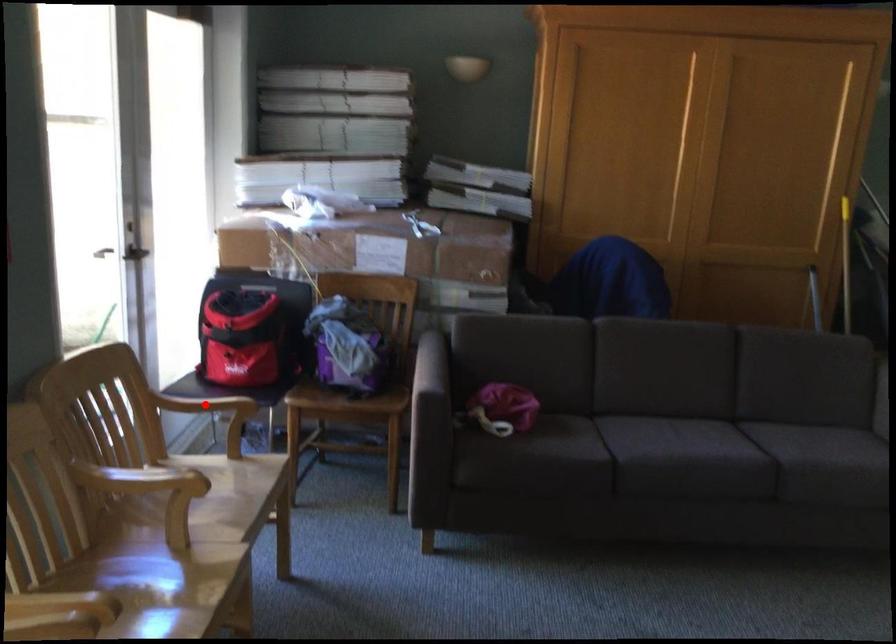
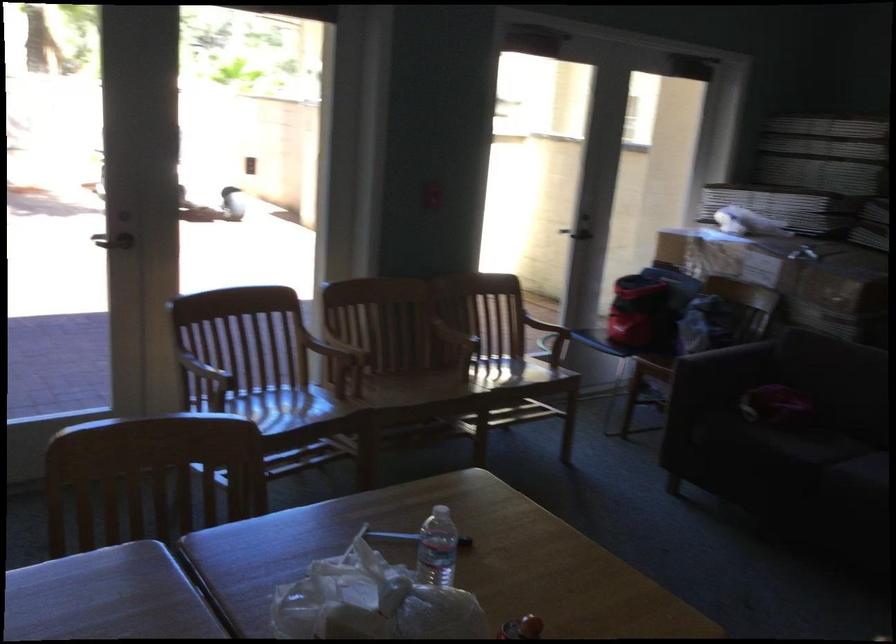
Question: I am providing you with two images of the same scene from different viewpoints. A red point is marked on the first image. Is the red point's position out of view in image 2?

Choices:
 (A) Yes
 (B) No

Answer: (A)